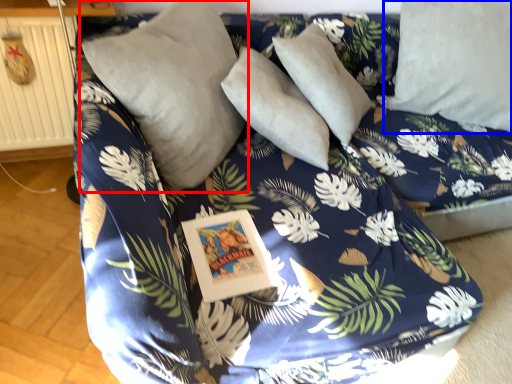
Question: Which object is further to the camera taking this photo, pillow (highlighted by a red box) or pillow (highlighted by a blue box)?

Choices:
 (A) pillow
 (B) pillow

Answer: (B)